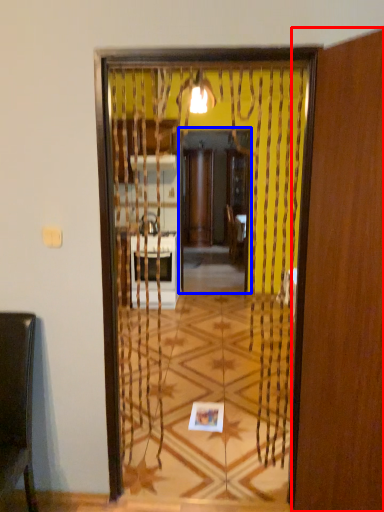
Question: Which point is closer to the camera, screen door (highlighted by a red box) or screen door (highlighted by a blue box)?

Choices:
 (A) screen door
 (B) screen door

Answer: (A)